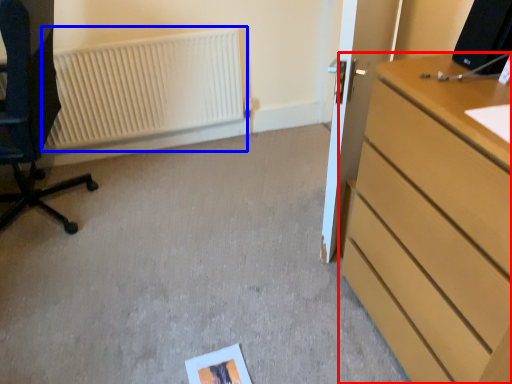
Question: Which point is further to the camera, chest of drawers (highlighted by a red box) or radiator (highlighted by a blue box)?

Choices:
 (A) chest of drawers
 (B) radiator

Answer: (B)